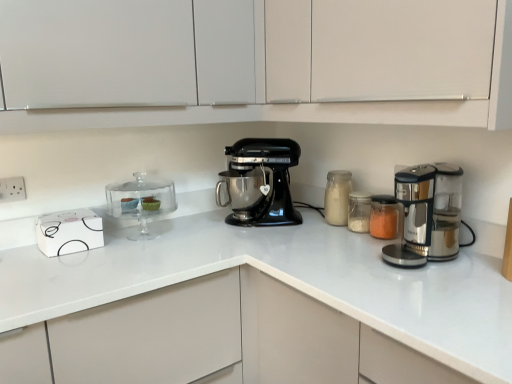
Question: Choose the correct answer: Is translucent glass jar at center-right inside translucent glass jar at center, which appears as the third appliance when viewed from the left, or outside it?

Choices:
 (A) inside
 (B) outside

Answer: (B)

Question: Is point (334, 213) closer or farther from the camera than point (373, 211)?

Choices:
 (A) farther
 (B) closer

Answer: (A)

Question: Considering the real-world distances, which object is farthest from the white plastic electric outlet at upper left?

Choices:
 (A) white matte cabinet at upper center, the second cabinetry positioned from the left
 (B) black matte mixer at center
 (C) translucent glass jar at center-right
 (D) translucent glass jar at center, placed as the 1th appliance when sorted from right to left
 (E) clear glass cake stand at left, the 3th appliance in the right-to-left sequence

Answer: (A)

Question: Which object is positioned closest to the translucent glass jar at center, which appears as the third appliance when viewed from the left?

Choices:
 (A) white matte cabinet at upper center, which appears as the second cabinetry when viewed from the right
 (B) clear glass cake stand at left, the 3th appliance in the right-to-left sequence
 (C) white plastic electric outlet at upper left
 (D) translucent glass jar at center, placed as the second appliance when sorted from right to left
 (E) black matte mixer at center

Answer: (D)